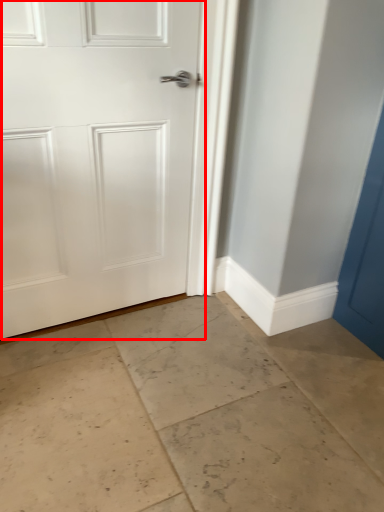
Question: From the image, what is the correct spatial relationship of door (annotated by the red box) in relation to concrete?

Choices:
 (A) left
 (B) right

Answer: (A)